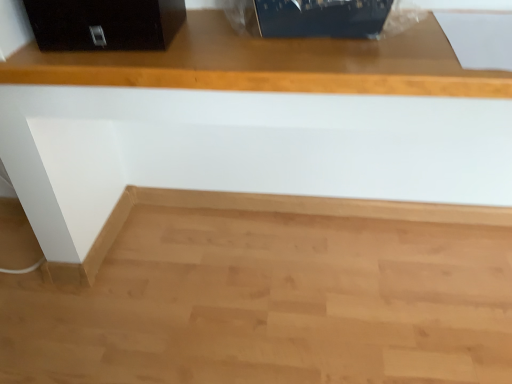
Question: From the image's perspective, relative to black glossy file cabinet at upper left, is natural wood cabinet at upper center above or below?

Choices:
 (A) above
 (B) below

Answer: (B)

Question: Is natural wood cabinet at upper center situated inside black glossy file cabinet at upper left or outside?

Choices:
 (A) outside
 (B) inside

Answer: (A)

Question: In terms of size, does natural wood cabinet at upper center appear bigger or smaller than black glossy file cabinet at upper left?

Choices:
 (A) small
 (B) big

Answer: (B)

Question: From the image's perspective, is black glossy file cabinet at upper left positioned above or below natural wood cabinet at upper center?

Choices:
 (A) below
 (B) above

Answer: (B)

Question: Is point (72, 16) closer or farther from the camera than point (15, 82)?

Choices:
 (A) closer
 (B) farther

Answer: (A)

Question: In terms of height, does black glossy file cabinet at upper left look taller or shorter compared to natural wood cabinet at upper center?

Choices:
 (A) short
 (B) tall

Answer: (A)

Question: In terms of width, does black glossy file cabinet at upper left look wider or thinner when compared to natural wood cabinet at upper center?

Choices:
 (A) wide
 (B) thin

Answer: (B)